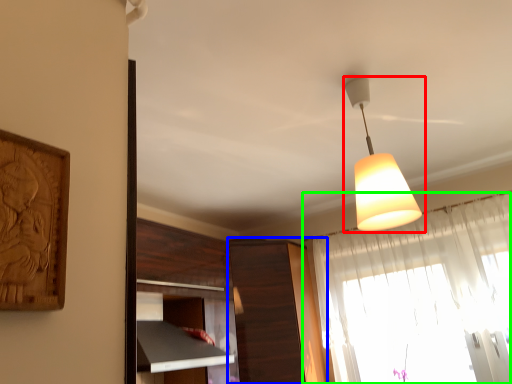
Question: Estimate the real-world distances between objects in this image. Which object is farther from lamp (highlighted by a red box), cabinetry (highlighted by a blue box) or curtain (highlighted by a green box)?

Choices:
 (A) cabinetry
 (B) curtain

Answer: (A)